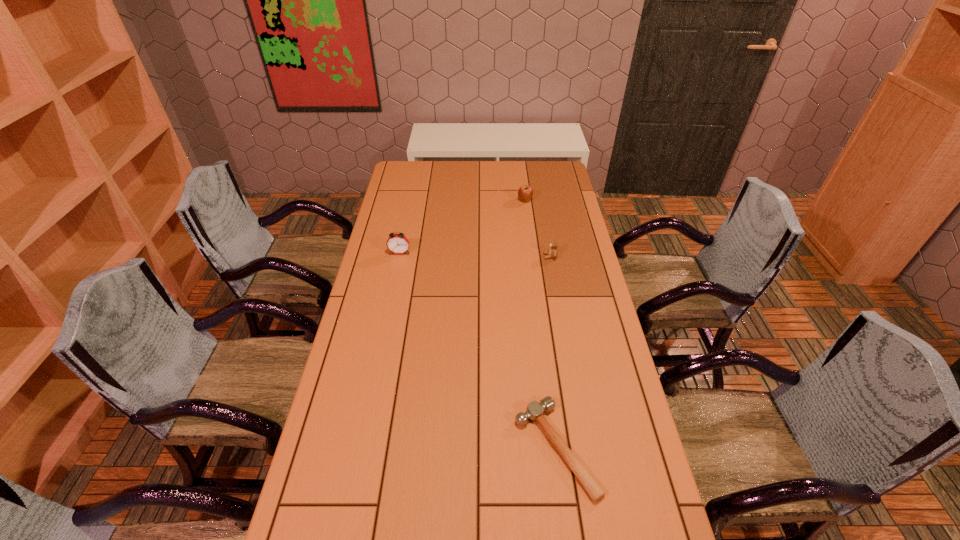
The image size is (960, 540). I want to click on the leftmost object, so click(397, 243).

What are the coordinates of `alarm clock` in the screenshot? It's located at (397, 243).

You are a GUI agent. You are given a task and a screenshot of the screen. Output one action in this format:
    pyautogui.click(x=<x>, y=<y>)
    Task: Click on the apple
    The height and width of the screenshot is (540, 960).
    Given the screenshot: What is the action you would take?
    pyautogui.click(x=525, y=193)

Identify the location of teddy bear. (553, 252).

The image size is (960, 540). I want to click on hammer, so click(x=535, y=410).

This screenshot has width=960, height=540. In order to click on the shortest object in this screenshot , I will do `click(535, 410)`.

Where is `vacant area situated on the clock face of the alarm clock`? vacant area situated on the clock face of the alarm clock is located at coordinates (387, 314).

You are a GUI agent. You are given a task and a screenshot of the screen. Output one action in this format:
    pyautogui.click(x=<x>, y=<y>)
    Task: Click on the vacant space situated 0.270m on the left of the apple
    This screenshot has width=960, height=540.
    Given the screenshot: What is the action you would take?
    pyautogui.click(x=459, y=200)

Where is `vacant space situated on the front-facing side of the teddy bear`? vacant space situated on the front-facing side of the teddy bear is located at coordinates (447, 256).

Find the location of a particular element. The width and height of the screenshot is (960, 540). vacant space situated on the front-facing side of the teddy bear is located at coordinates (466, 256).